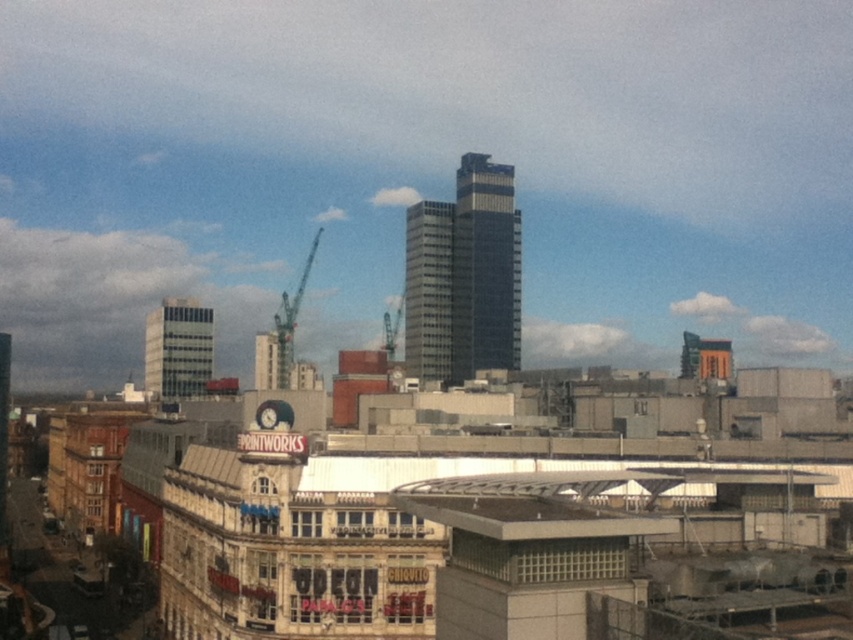
Question: Considering the relative positions of glassy silver skyscraper at center and white glass building at center-left in the image provided, where is glassy silver skyscraper at center located with respect to white glass building at center-left?

Choices:
 (A) right
 (B) left

Answer: (A)

Question: Can you confirm if glassy silver skyscraper at center is positioned to the right of metallic gray crane at center?

Choices:
 (A) no
 (B) yes

Answer: (B)

Question: Estimate the real-world distances between objects in this image. Which object is closer to the metallic gray crane at center?

Choices:
 (A) glassy silver skyscraper at center
 (B) dark glass skyscraper at center
 (C) white glass building at center-left

Answer: (A)

Question: Is dark glass skyscraper at center in front of white glass building at center-left?

Choices:
 (A) yes
 (B) no

Answer: (B)

Question: Which object is positioned closest to the glassy silver skyscraper at center?

Choices:
 (A) metallic gray crane at center
 (B) dark glass skyscraper at center

Answer: (B)

Question: Which object is positioned farthest from the dark glass skyscraper at center?

Choices:
 (A) metallic gray crane at center
 (B) glassy silver skyscraper at center
 (C) white glass building at center-left

Answer: (C)